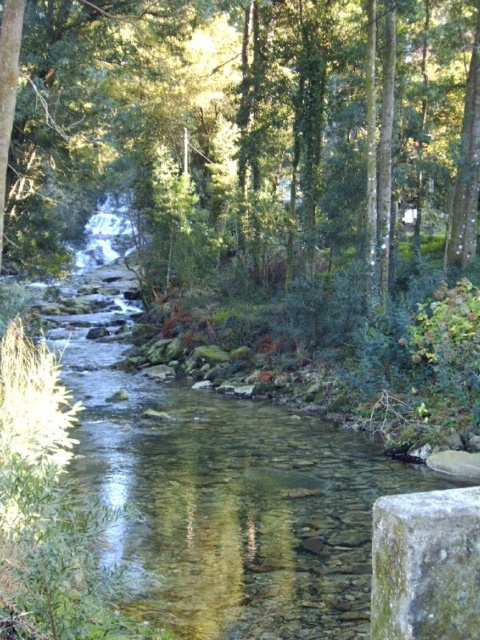
You are standing at the edge of the stream and see a point marked at coordinates (243, 129). What object is located at that point?

The point at coordinates (243, 129) indicates a green leafy tree at center.

You are standing at the edge of the stream and want to reach a point in the scene. Which of the two points, point (205, 186) or point (403, 525), is closer to you?

Point (205, 186) is closer to you because it is further to the camera than point (403, 525).

You are planning to cross the clear water stream at center using a wooden plank. The green leafy tree at center is nearby. Can the tree provide enough shade to cover the entire width of the stream?

The green leafy tree at center has a lesser width compared to clear water stream at center, so it cannot provide enough shade to cover the entire width of the stream.